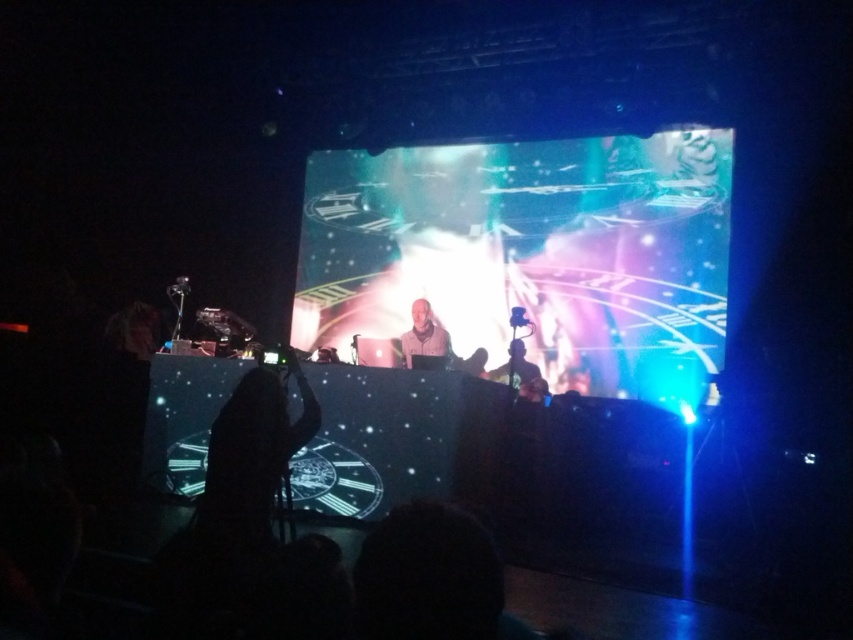
Question: Can you confirm if black fabric at center is bigger than matte white headphones at center?

Choices:
 (A) yes
 (B) no

Answer: (A)

Question: Does black fabric at center have a lesser width compared to matte white headphones at center?

Choices:
 (A) yes
 (B) no

Answer: (B)

Question: Among these objects, which one is nearest to the camera?

Choices:
 (A) black fabric at center
 (B) matte white headphones at center

Answer: (A)

Question: Is the position of black fabric at center less distant than that of matte white headphones at center?

Choices:
 (A) no
 (B) yes

Answer: (B)

Question: Which point appears closest to the camera in this image?

Choices:
 (A) (410, 330)
 (B) (281, 436)

Answer: (B)